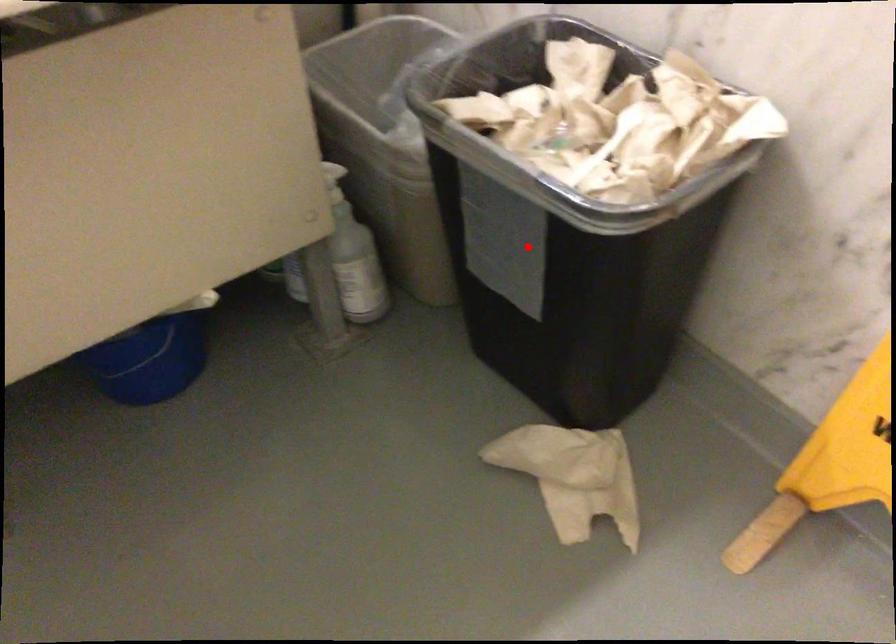
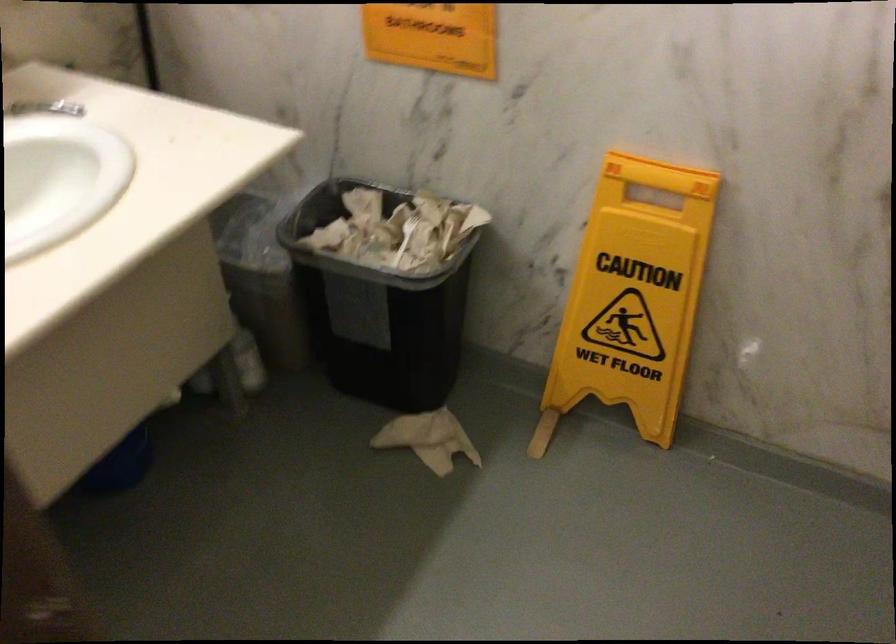
Question: A red point is marked in image1. In image2, is the corresponding 3D point closer to the camera or farther? Reply with the corresponding letter.

Choices:
 (A) The corresponding 3D point is closer.
 (B) The corresponding 3D point is farther.

Answer: (B)